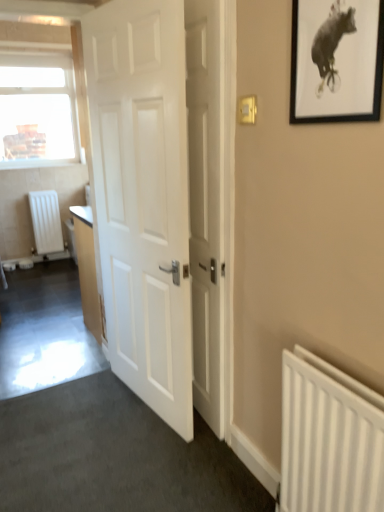
Question: Relative to white matte radiator at lower right, which is the 2th radiator in left-to-right order, is white plastic light switch at upper right in front or behind?

Choices:
 (A) front
 (B) behind

Answer: (B)

Question: Is white plastic light switch at upper right situated inside white matte radiator at lower right, which is the 2th radiator from top to bottom, or outside?

Choices:
 (A) inside
 (B) outside

Answer: (B)

Question: Based on their relative distances, which object is farther from the white wooden door at center, which is the 1th door in right-to-left order?

Choices:
 (A) white plastic light switch at upper right
 (B) black matte picture frame at upper right
 (C) white matte door at center, arranged as the 1th door when viewed from the left
 (D) clear glass window at upper left
 (E) white matte radiator at left, the 1th radiator from the top

Answer: (D)

Question: Based on their relative distances, which object is farther from the clear glass window at upper left?

Choices:
 (A) black matte picture frame at upper right
 (B) white wooden door at center, which is the 1th door in right-to-left order
 (C) white plastic light switch at upper right
 (D) white matte radiator at left, the 1th radiator from the top
 (E) white matte door at center, arranged as the 1th door when viewed from the left

Answer: (A)